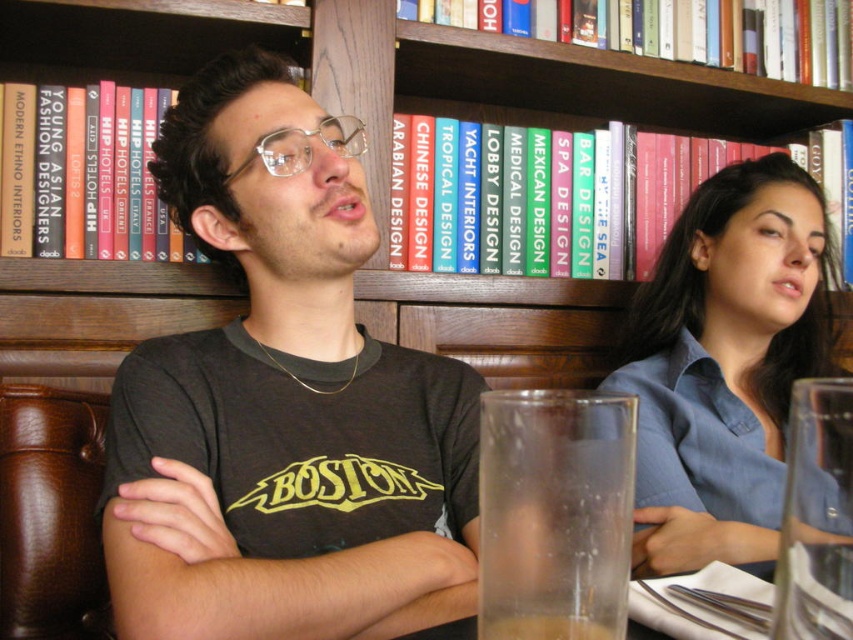
Question: Which point appears farthest from the camera in this image?

Choices:
 (A) (485, 636)
 (B) (436, 545)

Answer: (B)

Question: Does dark gray t-shirt at center have a larger size compared to clear plastic glasses at center?

Choices:
 (A) no
 (B) yes

Answer: (B)

Question: Which of the following is the farthest from the observer?

Choices:
 (A) translucent glass at center
 (B) blue cotton shirt at upper right
 (C) clear glass at lower center
 (D) dark gray t-shirt at center

Answer: (B)

Question: Is blue cotton shirt at upper right in front of clear plastic glasses at center?

Choices:
 (A) yes
 (B) no

Answer: (A)

Question: Considering the relative positions of dark gray t-shirt at center and translucent glass at center in the image provided, where is dark gray t-shirt at center located with respect to translucent glass at center?

Choices:
 (A) left
 (B) right

Answer: (A)

Question: Which of the following is the closest to the observer?

Choices:
 (A) (339, 352)
 (B) (596, 628)
 (C) (345, 115)

Answer: (B)